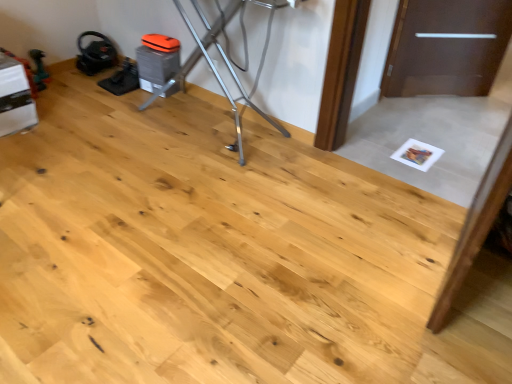
Locate an element on the screen. The height and width of the screenshot is (384, 512). vacant area that lies in front of metallic silver ironing board at upper center is located at coordinates (116, 218).